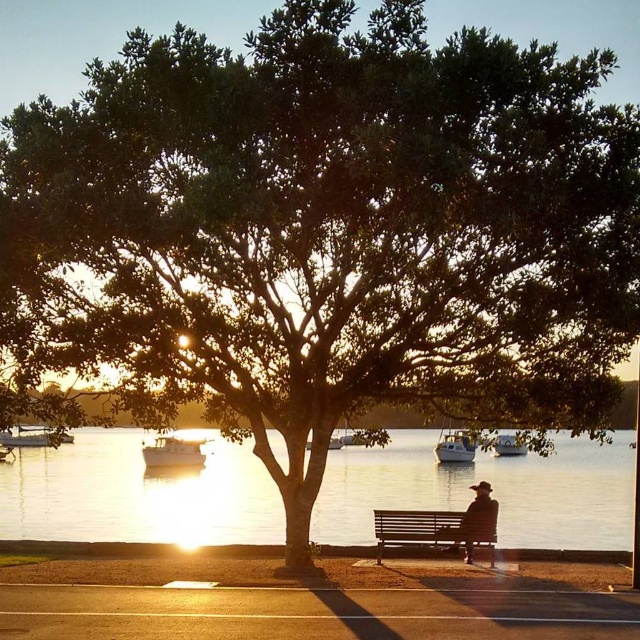
You are planning to host a small gathering for 4 people. The wooden bench at center can accommodate 2 people. Is the metallic silver boat at lower left big enough to seat the remaining guests?

The wooden bench at center has a larger size compared to metallic silver boat at lower left. Since the bench is bigger and can only seat 2 people, the metallic silver boat at lower left is smaller and likely not big enough to seat the remaining 2 guests.

Looking at this image, you are planning to place a small table between the wooden bench at center and the metallic silver boat at lower left. Considering their widths, which object should the table be closer to to ensure it fits properly?

The wooden bench at center is wider than the metallic silver boat at lower left. Therefore, placing the table closer to the wooden bench at center would allow it to fit better between them, as there is more space available near the wider object.